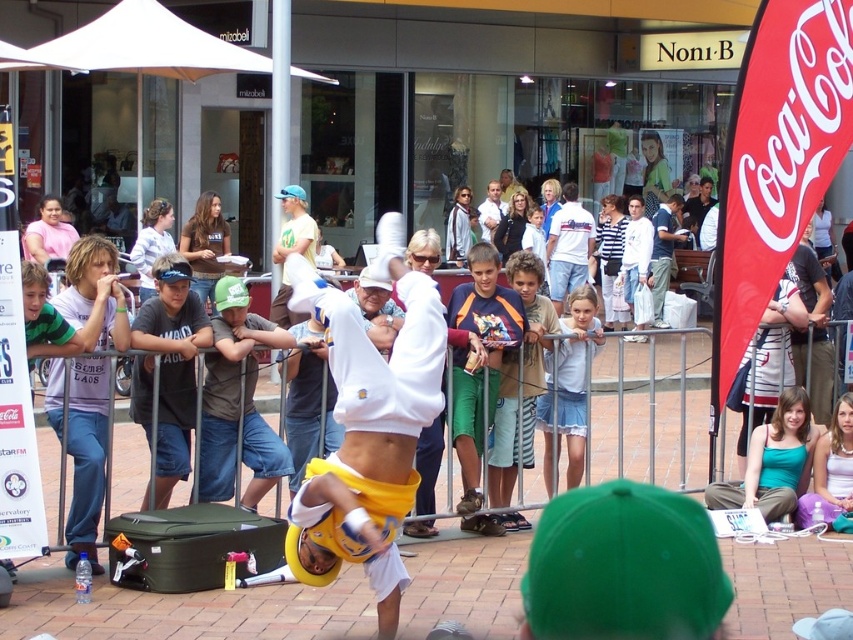
Question: Is white matte sweatshirt at center wider than white cotton shirt at center?

Choices:
 (A) no
 (B) yes

Answer: (A)

Question: Among these objects, which one is farthest from the camera?

Choices:
 (A) white cotton shirt at center
 (B) white matte sweatshirt at center

Answer: (A)

Question: Is white matte sweatshirt at center below white cotton shirt at center?

Choices:
 (A) yes
 (B) no

Answer: (A)

Question: Can you confirm if white matte sweatshirt at center is bigger than white cotton shirt at center?

Choices:
 (A) yes
 (B) no

Answer: (B)

Question: Which object is closer to the camera taking this photo?

Choices:
 (A) white cotton shirt at center
 (B) white matte sweatshirt at center

Answer: (B)